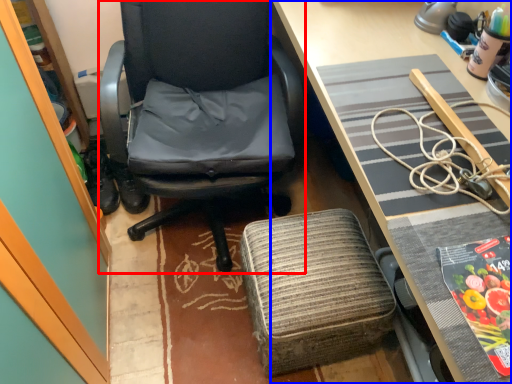
Question: Which point is closer to the camera, chair (highlighted by a red box) or desk (highlighted by a blue box)?

Choices:
 (A) chair
 (B) desk

Answer: (B)